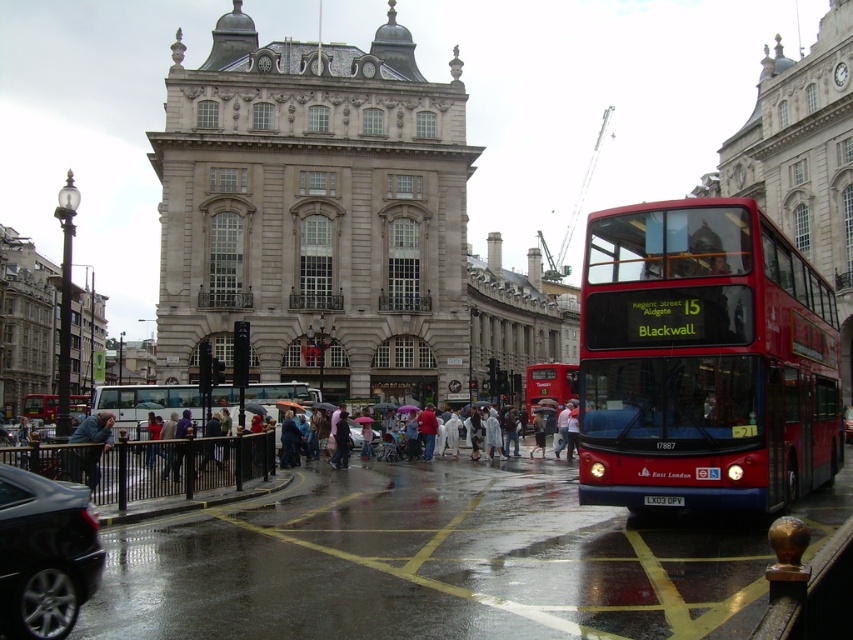
You are a photographer standing in the middle of the street. You want to take a photo of the red metallic bus at center and the blue denim jacket at lower left. Since you have a limited frame, you need to know which object is taller to prioritize composition. Which one is taller?

The red metallic bus at center is much taller than the blue denim jacket at lower left, so prioritize the red metallic bus at center in your composition.

You are standing at the point with coordinates (703, 360) in the image. What object is exactly at this location?

The red metallic bus at center is located at point (703, 360).

In the scene shown: You are a pedestrian standing on the sidewalk near the blue denim jacket at lower left. You want to cross the street to reach the red metallic bus at center. Is the bus in your way or behind you?

The red metallic bus at center is in front of the blue denim jacket at lower left, so the bus is in your way and you would need to go around it to reach the other side of the street.